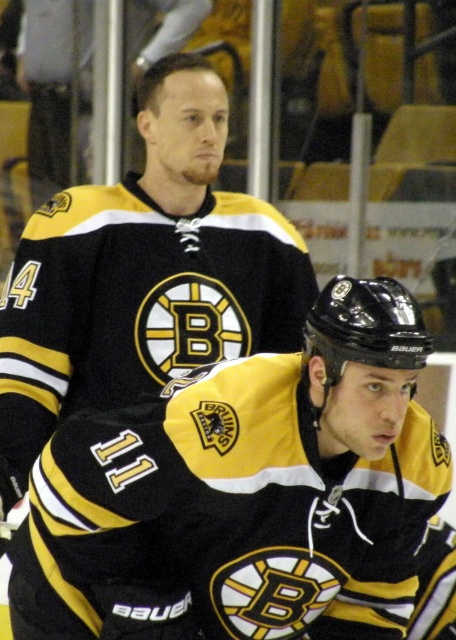
Between black matte jersey at center and black matte jersey at upper center, which one appears on the left side from the viewer's perspective?

black matte jersey at upper center is more to the left.

Can you confirm if black matte jersey at center is positioned to the left of black matte jersey at upper center?

In fact, black matte jersey at center is to the right of black matte jersey at upper center.

Does point (138, 444) come in front of point (114, 374)?

That is True.

The width and height of the screenshot is (456, 640). I want to click on black matte jersey at center, so click(245, 492).